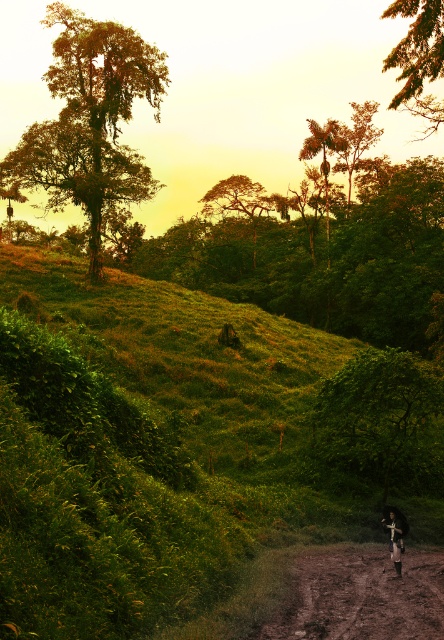
You are planning to ride a mountain bike along the path in this landscape. You notice the brown dirt track at lower right and the dark blue fabric mountain biker at center. Which object is higher in elevation?

The brown dirt track at lower right has a greater height compared to the dark blue fabric mountain biker at center, so the brown dirt track at lower right is higher in elevation.